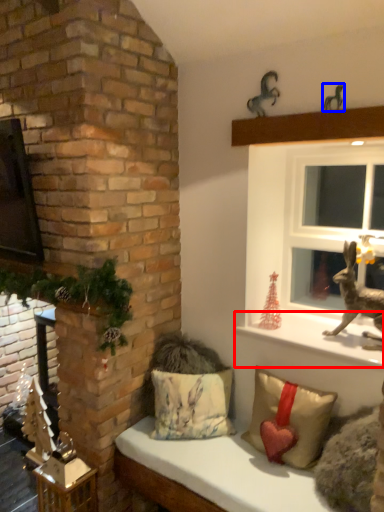
Question: Which object appears closest to the camera in this image, window sill (highlighted by a red box) or animal (highlighted by a blue box)?

Choices:
 (A) window sill
 (B) animal

Answer: (B)